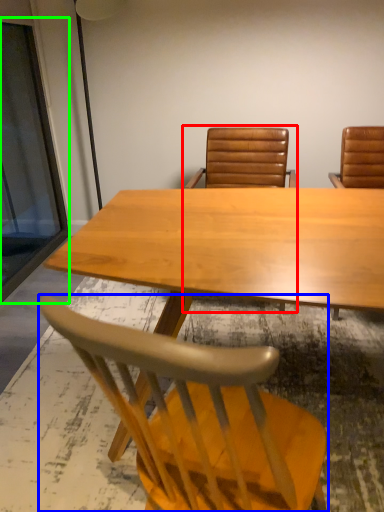
Question: Estimate the real-world distances between objects in this image. Which object is closer to chair (highlighted by a red box), chair (highlighted by a blue box) or glass door (highlighted by a green box)?

Choices:
 (A) chair
 (B) glass door

Answer: (B)